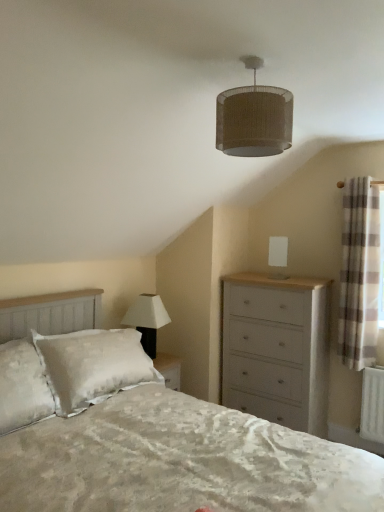
At what (x,y) coordinates should I click in order to perform the action: click on white matte lampshade at upper center, which appears as the 1th lamp when viewed from the back. Please return your answer as a coordinate pair (x, y). The image size is (384, 512). Looking at the image, I should click on (278, 256).

I want to click on plaid fabric curtain at right, so click(x=381, y=260).

This screenshot has width=384, height=512. Find the location of `burlap-textured lampshade at upper center, acting as the second lamp starting from the right`. burlap-textured lampshade at upper center, acting as the second lamp starting from the right is located at coordinates (254, 118).

What do you see at coordinates (147, 319) in the screenshot? I see `white matte lamp at upper center, acting as the second lamp starting from the back` at bounding box center [147, 319].

In order to face plaid fabric curtain at right, should I rotate leftwards or rightwards?

A 22.015 degree turn to the right will do.

Identify the location of white matte lampshade at upper center, placed as the 3th lamp when sorted from left to right. (278, 256).

From a real-world perspective, is white matte lamp at upper center, acting as the second lamp starting from the back, located higher than plaid fabric curtain at right?

No, from a real-world perspective, white matte lamp at upper center, acting as the second lamp starting from the back, is not over plaid fabric curtain at right

Is plaid fabric curtain at right completely or partially inside white matte lamp at upper center, positioned as the 1th lamp in bottom-to-top order?

That's incorrect, plaid fabric curtain at right is not inside white matte lamp at upper center, positioned as the 1th lamp in bottom-to-top order.

Can you see white matte lamp at upper center, positioned as the 1th lamp in bottom-to-top order, touching plaid fabric curtain at right?

No, white matte lamp at upper center, positioned as the 1th lamp in bottom-to-top order, is not with plaid fabric curtain at right.

Considering the relative sizes of white matte lamp at upper center, the 3th lamp in the top-to-bottom sequence, and plaid fabric curtain at right in the image provided, is white matte lamp at upper center, the 3th lamp in the top-to-bottom sequence, wider than plaid fabric curtain at right?

Yes, white matte lamp at upper center, the 3th lamp in the top-to-bottom sequence, is wider than plaid fabric curtain at right.

From a real-world perspective, is plaid fabric curtain at right above or below white textured bed at center?

In terms of real-world spatial position, plaid fabric curtain at right is above white textured bed at center.

Would you say plaid fabric curtain at right is a long distance from white textured bed at center?

Yes, plaid fabric curtain at right and white textured bed at center are located far from each other.

Where is `curtain that is behind the white textured bed at center`? This screenshot has height=512, width=384. curtain that is behind the white textured bed at center is located at coordinates (359, 273).

Is plaid fabric curtain at right further to the viewer compared to white textured bed at center?

Yes, plaid fabric curtain at right is further from the camera.

Could you tell me if burlap-textured lampshade at upper center, acting as the second lamp starting from the right, is facing white matte lampshade at upper center, the 1th lamp when ordered from right to left?

No.

Locate an element on the screen. The image size is (384, 512). lamp on the right of the burlap-textured lampshade at upper center, acting as the second lamp starting from the right is located at coordinates (278, 256).

Would you say burlap-textured lampshade at upper center, which is the 3th lamp in bottom-to-top order, contains white matte lampshade at upper center, which is the third lamp in front-to-back order?

No, white matte lampshade at upper center, which is the third lamp in front-to-back order, is not inside burlap-textured lampshade at upper center, which is the 3th lamp in bottom-to-top order.

Can you confirm if burlap-textured lampshade at upper center, placed as the 2th lamp when sorted from left to right, is positioned to the right of white matte lampshade at upper center, which is the third lamp in front-to-back order?

No, burlap-textured lampshade at upper center, placed as the 2th lamp when sorted from left to right, is not to the right of white matte lampshade at upper center, which is the third lamp in front-to-back order.

What's the angular difference between plaid fabric curtain at right and plaid fabric curtain at right's facing directions?

There is a 0.00976-degree angle between the facing directions of plaid fabric curtain at right and plaid fabric curtain at right.

Are plaid fabric curtain at right and plaid fabric curtain at right located far from each other?

They are positioned close to each other.

From the image's perspective, is plaid fabric curtain at right located beneath plaid fabric curtain at right?

No, from the image's perspective, plaid fabric curtain at right is not beneath plaid fabric curtain at right.

Which is in front, point (383, 216) or point (365, 204)?

Positioned in front is point (383, 216).

Find the location of a particular element. This screenshot has height=512, width=384. the 2nd lamp positioned below the plaid fabric curtain at right (from a real-world perspective) is located at coordinates (147, 319).

Which of these two, plaid fabric curtain at right or white matte lamp at upper center, marked as the 1th lamp in a left-to-right arrangement, stands shorter?

Standing shorter between the two is white matte lamp at upper center, marked as the 1th lamp in a left-to-right arrangement.

From a real-world perspective, which object rests below the other?

white matte lamp at upper center, marked as the 1th lamp in a left-to-right arrangement, from a real-world perspective.

Could you tell me if plaid fabric curtain at right is facing white matte lamp at upper center, positioned as the 1th lamp in bottom-to-top order?

No, plaid fabric curtain at right is not facing towards white matte lamp at upper center, positioned as the 1th lamp in bottom-to-top order.

How distant is burlap-textured lampshade at upper center, which appears as the third lamp when viewed from the back, from plaid fabric curtain at right?

burlap-textured lampshade at upper center, which appears as the third lamp when viewed from the back, and plaid fabric curtain at right are 1.58 meters apart.

In the scene shown: Considering the positions of objects burlap-textured lampshade at upper center, acting as the second lamp starting from the right, and plaid fabric curtain at right in the image provided, who is behind, burlap-textured lampshade at upper center, acting as the second lamp starting from the right, or plaid fabric curtain at right?

Positioned behind is plaid fabric curtain at right.

Based on the photo, can you confirm if burlap-textured lampshade at upper center, placed as the 2th lamp when sorted from left to right, is shorter than plaid fabric curtain at right?

Correct, burlap-textured lampshade at upper center, placed as the 2th lamp when sorted from left to right, is not as tall as plaid fabric curtain at right.

Could you tell me if burlap-textured lampshade at upper center, arranged as the 1th lamp when viewed from the top, is turned towards plaid fabric curtain at right?

No, burlap-textured lampshade at upper center, arranged as the 1th lamp when viewed from the top, does not turn towards plaid fabric curtain at right.

From the image's perspective, is white painted wood chest of drawers at right located above or below plaid fabric curtain at right?

Based on their image positions, white painted wood chest of drawers at right is located beneath plaid fabric curtain at right.

What's the angular difference between white painted wood chest of drawers at right and plaid fabric curtain at right's facing directions?

They differ by 0.00023 degrees in their facing directions.

From the picture: Is white painted wood chest of drawers at right to the right of plaid fabric curtain at right from the viewer's perspective?

In fact, white painted wood chest of drawers at right is to the left of plaid fabric curtain at right.

Does white painted wood chest of drawers at right touch plaid fabric curtain at right?

white painted wood chest of drawers at right is not next to plaid fabric curtain at right, and they're not touching.

Locate an element on the screen. curtain lying above the white matte lamp at upper center, the 3th lamp in the top-to-bottom sequence (from the image's perspective) is located at coordinates (359, 273).

This screenshot has width=384, height=512. I want to click on bed that appears below the plaid fabric curtain at right (from the image's perspective), so click(180, 461).

Which object lies nearer to the anchor point burlap-textured lampshade at upper center, placed as the 2th lamp when sorted from left to right, plaid fabric curtain at right or white textured bed at center?

The object closer to burlap-textured lampshade at upper center, placed as the 2th lamp when sorted from left to right, is white textured bed at center.

When comparing their distances from white painted wood chest of drawers at right, does burlap-textured lampshade at upper center, which is counted as the 1th lamp, starting from the front, or white textured bed at center seem further?

The object further to white painted wood chest of drawers at right is burlap-textured lampshade at upper center, which is counted as the 1th lamp, starting from the front.

Which object lies nearer to the anchor point burlap-textured lampshade at upper center, which is the 3th lamp in bottom-to-top order, white matte lampshade at upper center, which is the third lamp in front-to-back order, or white painted wood chest of drawers at right?

white painted wood chest of drawers at right lies closer to burlap-textured lampshade at upper center, which is the 3th lamp in bottom-to-top order, than the other object.

When comparing their distances from plaid fabric curtain at right, does white matte lampshade at upper center, the 2th lamp in the bottom-to-top sequence, or white textured bed at center seem closer?

Based on the image, white matte lampshade at upper center, the 2th lamp in the bottom-to-top sequence, appears to be nearer to plaid fabric curtain at right.

When comparing their distances from white painted wood chest of drawers at right, does white matte lampshade at upper center, the 2th lamp in the bottom-to-top sequence, or burlap-textured lampshade at upper center, arranged as the 1th lamp when viewed from the top, seem further?

Among the two, burlap-textured lampshade at upper center, arranged as the 1th lamp when viewed from the top, is located further to white painted wood chest of drawers at right.

Based on the photo, based on their spatial positions, is white matte lamp at upper center, which is the 3th lamp from right to left, or white matte lampshade at upper center, placed as the 3th lamp when sorted from left to right, closer to white textured bed at center?

Based on the image, white matte lamp at upper center, which is the 3th lamp from right to left, appears to be nearer to white textured bed at center.

Which object lies nearer to the anchor point burlap-textured lampshade at upper center, which is counted as the 1th lamp, starting from the front, plaid fabric curtain at right or white painted wood chest of drawers at right?

Among the two, plaid fabric curtain at right is located nearer to burlap-textured lampshade at upper center, which is counted as the 1th lamp, starting from the front.

Looking at the image, which one is located further to white painted wood chest of drawers at right, plaid fabric curtain at right or white matte lampshade at upper center, the 1th lamp when ordered from right to left?

white matte lampshade at upper center, the 1th lamp when ordered from right to left, is positioned further to the anchor white painted wood chest of drawers at right.

I want to click on the chest of drawers located between burlap-textured lampshade at upper center, which appears as the third lamp when viewed from the back, and white matte lamp at upper center, the 3th lamp in the top-to-bottom sequence, in the depth direction, so click(x=277, y=349).

This screenshot has width=384, height=512. I want to click on curtain positioned between burlap-textured lampshade at upper center, acting as the second lamp starting from the right, and plaid fabric curtain at right from near to far, so click(x=359, y=273).

The width and height of the screenshot is (384, 512). Identify the location of curtain between white textured bed at center and plaid fabric curtain at right from front to back. (359, 273).

The height and width of the screenshot is (512, 384). What are the coordinates of `curtain between white painted wood chest of drawers at right and plaid fabric curtain at right from left to right` in the screenshot? It's located at (359, 273).